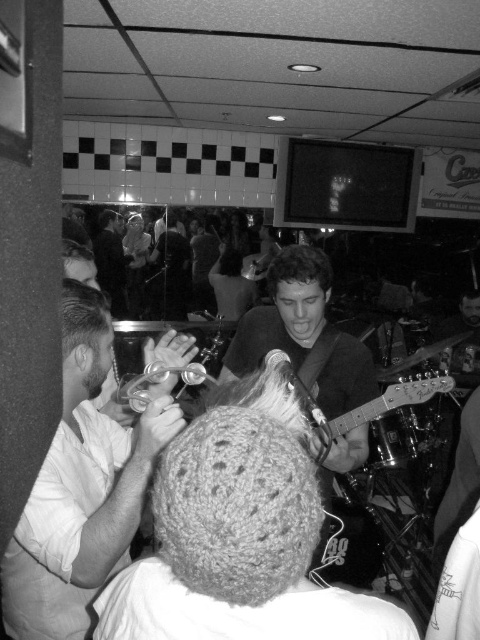
You are a photographer at the bar and want to take a photo of the white cotton shirt at left and the metallic silver guitar at center. Which object should you focus on first if you want to capture both in the same frame without moving the camera?

The white cotton shirt at left is located below the metallic silver guitar at center, so you should focus on the metallic silver guitar at center first since it is higher in the frame, allowing the shirt to naturally fall into the composition below it.

You are at the bar and want to order a drink from the bartender. The bartender is wearing the white cotton shirt at left and is playing the metallic silver guitar at center. Which object should you look at to find the bartender?

The bartender is wearing the white cotton shirt at left, so you should look at the white cotton shirt at left to find them.